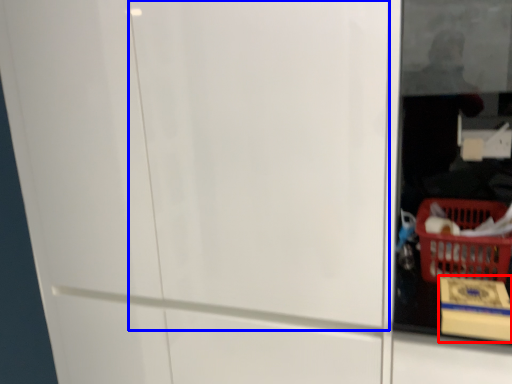
Question: Which point is further to the camera, cardboard box (highlighted by a red box) or screen door (highlighted by a blue box)?

Choices:
 (A) cardboard box
 (B) screen door

Answer: (A)